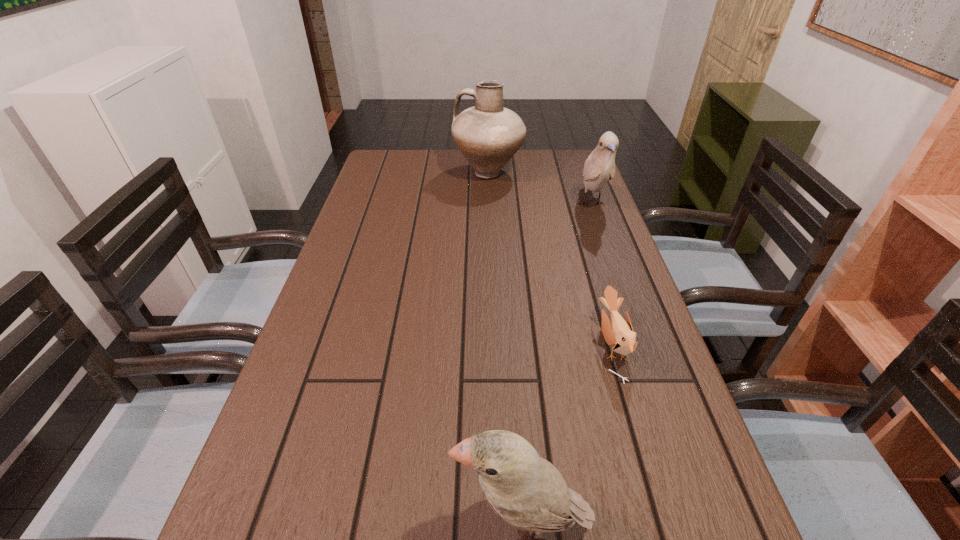
Find the location of a particular element. The height and width of the screenshot is (540, 960). object that is the second closest to the farthest bird is located at coordinates (620, 335).

You are a GUI agent. You are given a task and a screenshot of the screen. Output one action in this format:
    pyautogui.click(x=<x>, y=<y>)
    Task: Click on the object that can be found as the closest to the farthest bird
    The height and width of the screenshot is (540, 960).
    Given the screenshot: What is the action you would take?
    pyautogui.click(x=488, y=135)

Find the location of `the second closest bird relative to the farthest bird`. the second closest bird relative to the farthest bird is located at coordinates (525, 490).

Point out which bird is positioned as the second nearest to the farthest bird. Please provide its 2D coordinates. Your answer should be formatted as a tuple, i.e. [(x, y)], where the tuple contains the x and y coordinates of a point satisfying the conditions above.

[(525, 490)]

You are a GUI agent. You are given a task and a screenshot of the screen. Output one action in this format:
    pyautogui.click(x=<x>, y=<y>)
    Task: Click on the free location that satisfies the following two spatial constraints: 1. at the beak of the farthest bird; 2. at the beak of the shortest object
    The height and width of the screenshot is (540, 960).
    Given the screenshot: What is the action you would take?
    pyautogui.click(x=643, y=345)

In order to click on free space in the image that satisfies the following two spatial constraints: 1. at the beak of the farthest bird; 2. at the beak of the shortest object in this screenshot , I will do `click(643, 345)`.